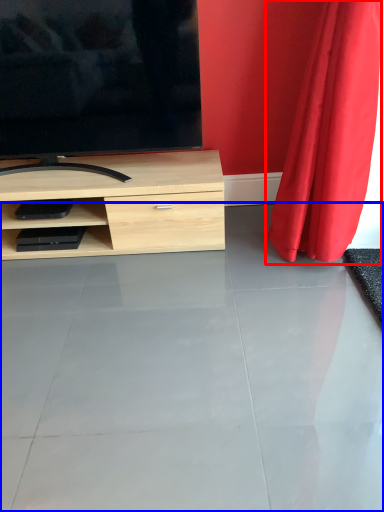
Question: Which point is closer to the camera, curtain (highlighted by a red box) or concrete (highlighted by a blue box)?

Choices:
 (A) curtain
 (B) concrete

Answer: (B)